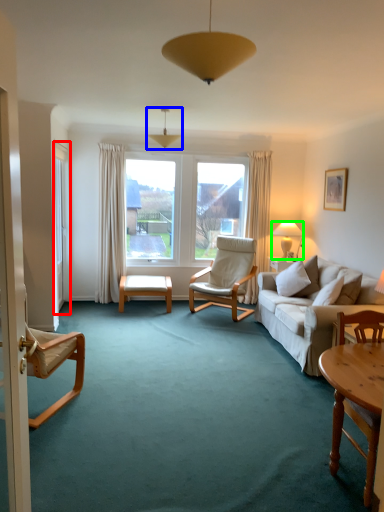
Question: Which object is positioned closest to screen door (highlighted by a red box)? Select from lamp (highlighted by a blue box) and lamp (highlighted by a green box).

Choices:
 (A) lamp
 (B) lamp

Answer: (A)